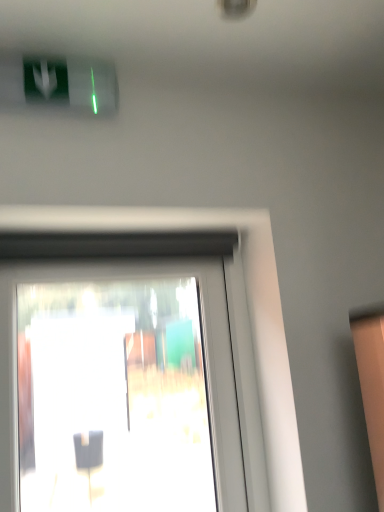
This screenshot has width=384, height=512. I want to click on transparent glass window at lower left, so click(201, 324).

The width and height of the screenshot is (384, 512). What do you see at coordinates (201, 324) in the screenshot?
I see `transparent glass window at lower left` at bounding box center [201, 324].

What are the coordinates of `transparent glass window at lower left` in the screenshot? It's located at (201, 324).